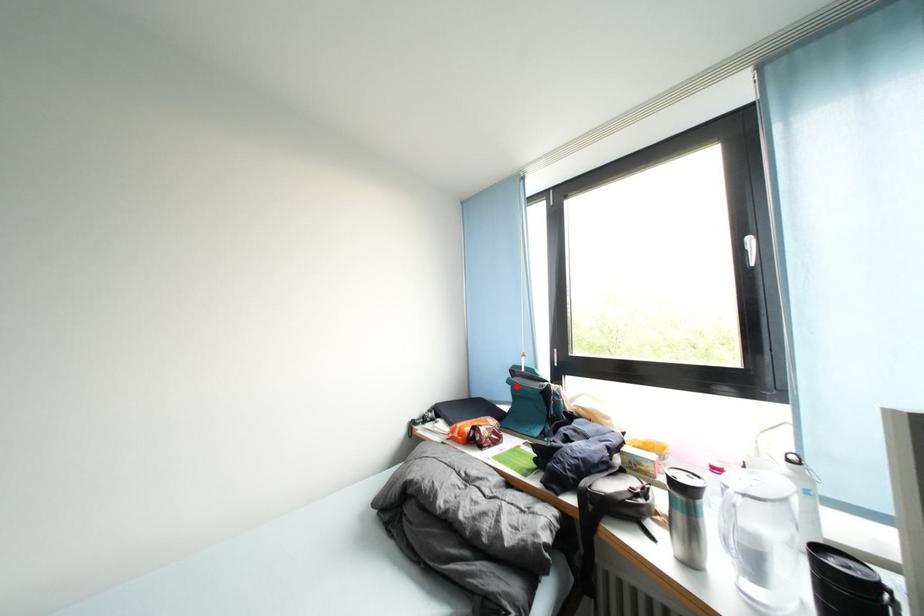
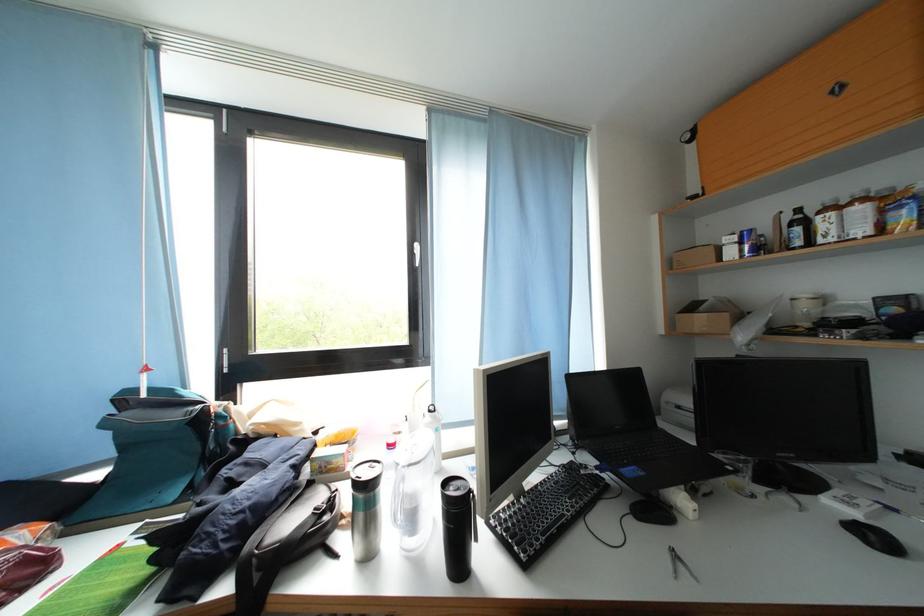
The point at the highlighted location is marked in the first image. Where is the corresponding point in the second image?

(114, 429)